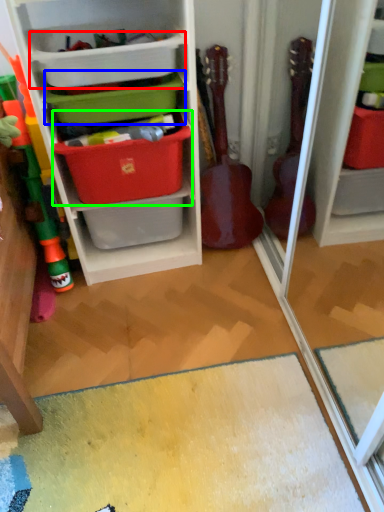
Question: Based on their relative distances, which object is farther from storage box (highlighted by a red box)? Choose from storage box (highlighted by a blue box) and storage box (highlighted by a green box).

Choices:
 (A) storage box
 (B) storage box

Answer: (B)